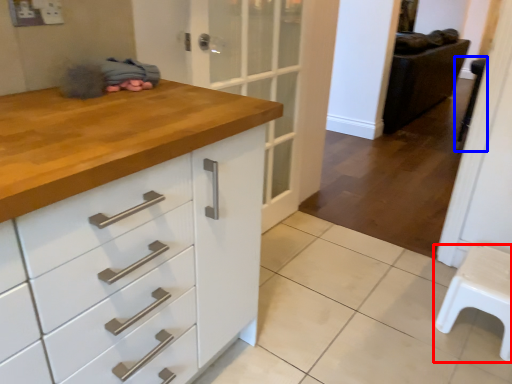
Question: Which point is closer to the camera, furniture (highlighted by a red box) or step stool (highlighted by a blue box)?

Choices:
 (A) furniture
 (B) step stool

Answer: (A)